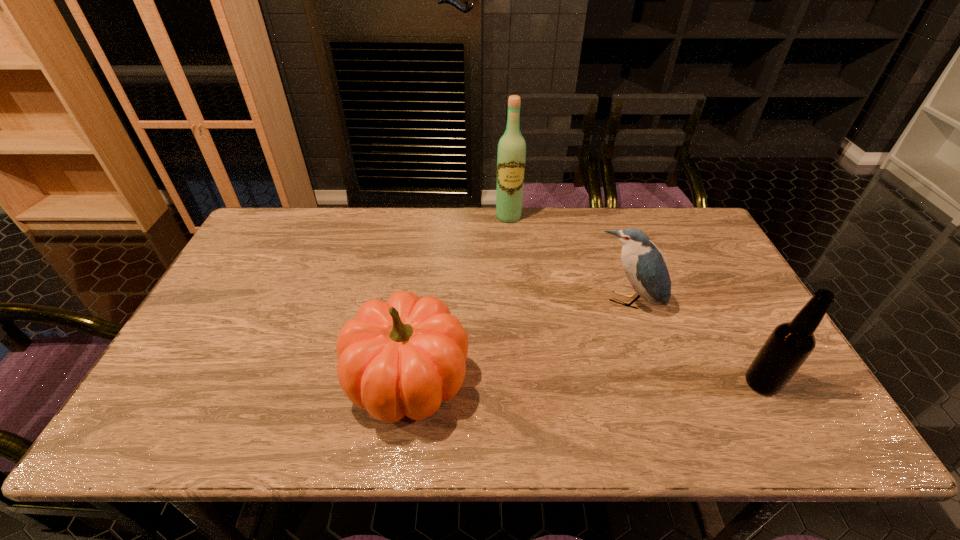
Where is `vacant space at the near edge of the desktop`? The image size is (960, 540). vacant space at the near edge of the desktop is located at coordinates (624, 397).

In the image, there is a desktop. Where is `free region at the right edge`? The image size is (960, 540). free region at the right edge is located at coordinates (723, 273).

Identify the location of free location at the far left corner. (272, 221).

Locate an element on the screen. Image resolution: width=960 pixels, height=540 pixels. free spot at the near left corner of the desktop is located at coordinates (173, 396).

The width and height of the screenshot is (960, 540). Identify the location of free space at the far right corner of the desktop. (699, 225).

Image resolution: width=960 pixels, height=540 pixels. Identify the location of free space that is in between the rightmost object and the pumpkin. (585, 381).

Locate an element on the screen. The width and height of the screenshot is (960, 540). vacant region between the wine bottle and the leftmost object is located at coordinates (458, 298).

Locate an element on the screen. vacant region between the beer bottle and the third nearest object is located at coordinates (695, 343).

Locate an element on the screen. vacant space that's between the third object from left to right and the wine bottle is located at coordinates (568, 260).

Where is `free space between the third object from left to right and the pumpkin`? This screenshot has height=540, width=960. free space between the third object from left to right and the pumpkin is located at coordinates (517, 341).